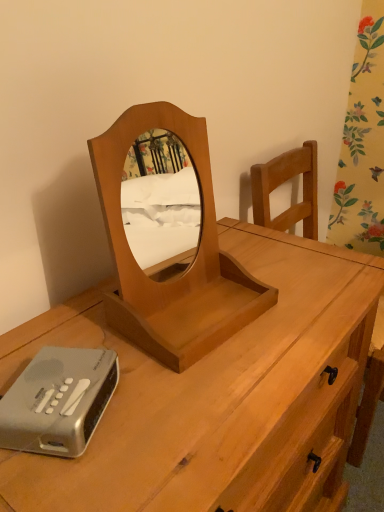
Where is `vacant area that lies between silver plastic alarm clock at lower left and light brown wood mirror at center`? vacant area that lies between silver plastic alarm clock at lower left and light brown wood mirror at center is located at coordinates (137, 379).